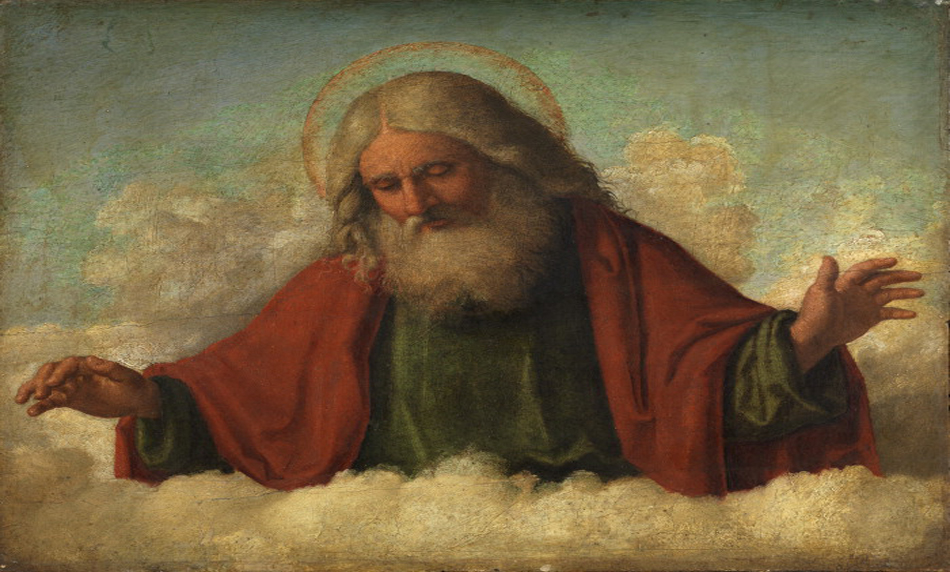
Identify the location of red cloth. This screenshot has height=572, width=950. (317, 369).